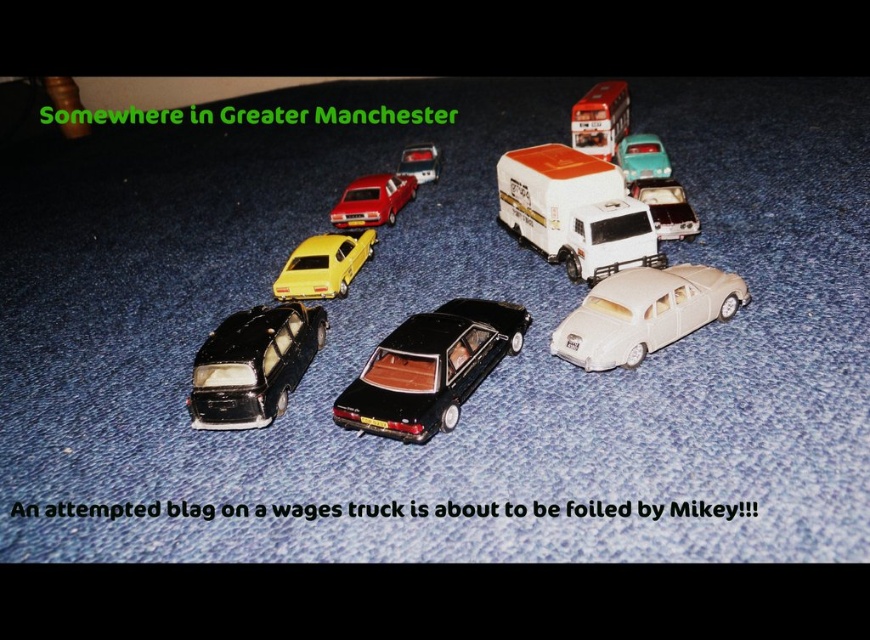
Question: Is metallic silver truck at center-right thinner than matte teal car at upper right?

Choices:
 (A) yes
 (B) no

Answer: (A)

Question: Does glossy black car at center-left appear on the left side of matte black car at upper center?

Choices:
 (A) no
 (B) yes

Answer: (B)

Question: Which point is closer to the camera taking this photo?

Choices:
 (A) click(640, 138)
 (B) click(425, 180)
 (C) click(365, 250)

Answer: (C)

Question: Which point appears farthest from the camera in this image?

Choices:
 (A) (211, 388)
 (B) (454, 307)
 (C) (416, 161)
 (D) (593, 355)

Answer: (C)

Question: Does glossy black car at center-left have a smaller size compared to matte red car at center?

Choices:
 (A) no
 (B) yes

Answer: (A)

Question: Which of the following is the closest to the observer?

Choices:
 (A) matte yellow car at center
 (B) glossy black car at center

Answer: (B)